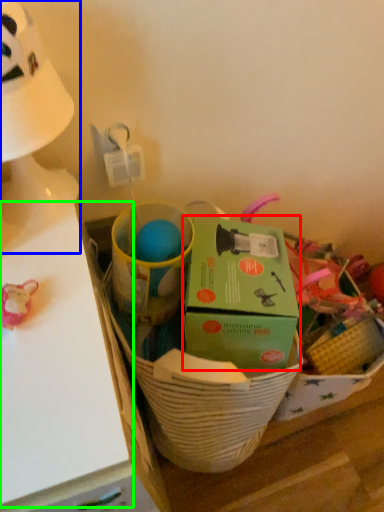
Question: Considering the real-world distances, which object is closest to box (highlighted by a red box)? table lamp (highlighted by a blue box) or table (highlighted by a green box).

Choices:
 (A) table lamp
 (B) table

Answer: (B)